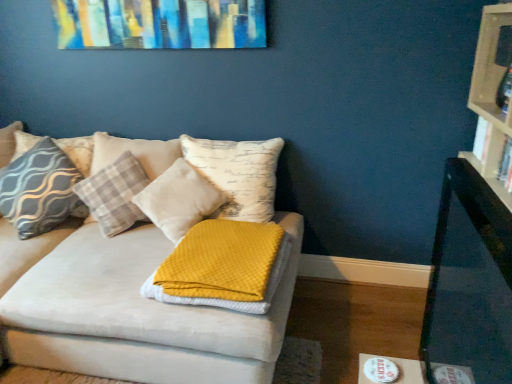
You are a GUI agent. You are given a task and a screenshot of the screen. Output one action in this format:
    pyautogui.click(x=<x>, y=<y>)
    Task: Click on the black glossy table at right
    
    Given the screenshot: What is the action you would take?
    pyautogui.click(x=470, y=280)

Image resolution: width=512 pixels, height=384 pixels. Identify the location of plaid fabric pillow at left, which ranks as the third pillow in right-to-left order. (78, 152).

Identify the location of white paper book at right, positioned as the 1th book in back-to-front order. (493, 152).

At what (x,y) coordinates should I click in order to perform the action: click on material behind the black glossy table at right. Please return your answer as a coordinate pair (x, y). This screenshot has width=512, height=384. Looking at the image, I should click on (228, 300).

Which object is positioned more to the left, black glossy table at right or waffle-textured yellow blanket at center?

From the viewer's perspective, waffle-textured yellow blanket at center appears more on the left side.

Is black glossy table at right turned away from waffle-textured yellow blanket at center?

That's not correct — black glossy table at right is not looking away from waffle-textured yellow blanket at center.

Is black glossy table at right smaller than waffle-textured yellow blanket at center?

No, black glossy table at right is not smaller than waffle-textured yellow blanket at center.

From the image's perspective, relative to hardcover book at right, acting as the second book starting from the back, is plaid fabric pillow at left, which ranks as the third pillow in right-to-left order, above or below?

plaid fabric pillow at left, which ranks as the third pillow in right-to-left order, is situated higher than hardcover book at right, acting as the second book starting from the back, in the image.

Does plaid fabric pillow at left, acting as the first pillow starting from the left, have a greater width compared to hardcover book at right, acting as the second book starting from the back?

Yes, plaid fabric pillow at left, acting as the first pillow starting from the left, is wider than hardcover book at right, acting as the second book starting from the back.

Looking at this image, is plaid fabric pillow at left, which ranks as the third pillow in right-to-left order, facing towards hardcover book at right, acting as the second book starting from the back?

No, plaid fabric pillow at left, which ranks as the third pillow in right-to-left order, is not aimed at hardcover book at right, acting as the second book starting from the back.

Relative to hardcover book at right, acting as the second book starting from the back, is plaid fabric pillow at left, which ranks as the third pillow in right-to-left order, in front or behind?

Clearly, plaid fabric pillow at left, which ranks as the third pillow in right-to-left order, is behind hardcover book at right, acting as the second book starting from the back.

From a real-world perspective, is white paper book at right, positioned as the 1th book in back-to-front order, physically located above or below gray wavy-patterned pillow at left, the second pillow positioned from the left?

white paper book at right, positioned as the 1th book in back-to-front order, is above gray wavy-patterned pillow at left, the second pillow positioned from the left.

Is white paper book at right, positioned as the 2th book in front-to-back order, behind gray wavy-patterned pillow at left, the second pillow positioned from the left?

That is False.

Is white paper book at right, positioned as the 1th book in back-to-front order, at the right side of gray wavy-patterned pillow at left, which ranks as the 2th pillow in right-to-left order?

Correct, you'll find white paper book at right, positioned as the 1th book in back-to-front order, to the right of gray wavy-patterned pillow at left, which ranks as the 2th pillow in right-to-left order.

Can you tell me how much white paper book at right, positioned as the 2th book in front-to-back order, and plaid fabric pillow at left, acting as the first pillow starting from the left, differ in facing direction?

The facing directions of white paper book at right, positioned as the 2th book in front-to-back order, and plaid fabric pillow at left, acting as the first pillow starting from the left, are 89.4 degrees apart.

Is white paper book at right, positioned as the 1th book in back-to-front order, taller or shorter than plaid fabric pillow at left, acting as the first pillow starting from the left?

Clearly, white paper book at right, positioned as the 1th book in back-to-front order, is shorter compared to plaid fabric pillow at left, acting as the first pillow starting from the left.

Is white paper book at right, positioned as the 1th book in back-to-front order, touching plaid fabric pillow at left, which ranks as the third pillow in right-to-left order?

They are not placed beside each other.

Is white paper book at right, positioned as the 1th book in back-to-front order, bigger or smaller than plaid fabric pillow at left, which ranks as the third pillow in right-to-left order?

white paper book at right, positioned as the 1th book in back-to-front order, is smaller than plaid fabric pillow at left, which ranks as the third pillow in right-to-left order.

From a real-world perspective, count 3rd pillows downward from the hardcover book at right, acting as the second book starting from the back, and point to it. Please provide its 2D coordinates.

[(178, 200)]

Considering the relative positions of hardcover book at right, which is the 1th book from front to back, and soft white pillow at center, the 3th pillow in the left-to-right sequence, in the image provided, is hardcover book at right, which is the 1th book from front to back, behind soft white pillow at center, the 3th pillow in the left-to-right sequence,?

No, hardcover book at right, which is the 1th book from front to back, is closer to the camera.

Looking at this image, based on their sizes in the image, would you say hardcover book at right, which is the 1th book from front to back, is bigger or smaller than soft white pillow at center, which appears as the 1th pillow when viewed from the right?

Considering their sizes, hardcover book at right, which is the 1th book from front to back, takes up less space than soft white pillow at center, which appears as the 1th pillow when viewed from the right.

Relative to waffle-textured yellow blanket at center, is plaid fabric pillow at left, which ranks as the third pillow in right-to-left order, in front or behind?

plaid fabric pillow at left, which ranks as the third pillow in right-to-left order, is behind waffle-textured yellow blanket at center.

Is plaid fabric pillow at left, acting as the first pillow starting from the left, taller or shorter than waffle-textured yellow blanket at center?

In the image, plaid fabric pillow at left, acting as the first pillow starting from the left, appears to be taller than waffle-textured yellow blanket at center.

Considering the relative positions of plaid fabric pillow at left, which ranks as the third pillow in right-to-left order, and waffle-textured yellow blanket at center in the image provided, is plaid fabric pillow at left, which ranks as the third pillow in right-to-left order, to the right of waffle-textured yellow blanket at center from the viewer's perspective?

Incorrect, plaid fabric pillow at left, which ranks as the third pillow in right-to-left order, is not on the right side of waffle-textured yellow blanket at center.

At what (x,y) coordinates should I click in order to perform the action: click on material below the plaid fabric pillow at left, acting as the first pillow starting from the left (from the image's perspective). Please return your answer as a coordinate pair (x, y). This screenshot has height=384, width=512. Looking at the image, I should click on (228, 300).

Is soft white pillow at center, which appears as the 1th pillow when viewed from the right, in front of or behind white paper book at right, positioned as the 1th book in back-to-front order, in the image?

Clearly, soft white pillow at center, which appears as the 1th pillow when viewed from the right, is behind white paper book at right, positioned as the 1th book in back-to-front order.

From the image's perspective, which is above, soft white pillow at center, the 3th pillow in the left-to-right sequence, or white paper book at right, positioned as the 1th book in back-to-front order?

white paper book at right, positioned as the 1th book in back-to-front order, from the image's perspective.

Starting from the soft white pillow at center, the 3th pillow in the left-to-right sequence, which book is the 1st one in front? Please provide its 2D coordinates.

[(493, 152)]

In the scene shown: Can you tell me how much soft white pillow at center, the 3th pillow in the left-to-right sequence, and white paper book at right, positioned as the 2th book in front-to-back order, differ in facing direction?

They differ by 77.3 degrees in their facing directions.

Image resolution: width=512 pixels, height=384 pixels. What are the coordinates of `material behind the black glossy table at right` in the screenshot? It's located at (228, 300).

Find the location of a particular element. pillow that is above the hardcover book at right, acting as the second book starting from the back (from the image's perspective) is located at coordinates (78, 152).

Looking at the image, which one is located further to soft white pillow at center, the 3th pillow in the left-to-right sequence, gray wavy-patterned pillow at left, the second pillow positioned from the left, or plaid fabric pillow at left, which ranks as the third pillow in right-to-left order?

plaid fabric pillow at left, which ranks as the third pillow in right-to-left order, is positioned further to the anchor soft white pillow at center, the 3th pillow in the left-to-right sequence.

Based on their spatial positions, is soft white pillow at center, the 3th pillow in the left-to-right sequence, or black glossy table at right further from waffle-textured yellow blanket at center?

black glossy table at right lies further to waffle-textured yellow blanket at center than the other object.

Which object lies nearer to the anchor point gray wavy-patterned pillow at left, the second pillow positioned from the left, soft white pillow at center, the 3th pillow in the left-to-right sequence, or plaid fabric pillow at left, which ranks as the third pillow in right-to-left order?

plaid fabric pillow at left, which ranks as the third pillow in right-to-left order, is closer to gray wavy-patterned pillow at left, the second pillow positioned from the left.

Based on their spatial positions, is gray wavy-patterned pillow at left, which ranks as the 2th pillow in right-to-left order, or black glossy table at right further from white paper book at right, positioned as the 1th book in back-to-front order?

gray wavy-patterned pillow at left, which ranks as the 2th pillow in right-to-left order, lies further to white paper book at right, positioned as the 1th book in back-to-front order, than the other object.

Considering their positions, is gray wavy-patterned pillow at left, which ranks as the 2th pillow in right-to-left order, positioned further to waffle-textured yellow blanket at center than hardcover book at right, which is the 1th book from front to back?

Based on the image, hardcover book at right, which is the 1th book from front to back, appears to be further to waffle-textured yellow blanket at center.

Estimate the real-world distances between objects in this image. Which object is closer to waffle-textured yellow blanket at center, gray wavy-patterned pillow at left, which ranks as the 2th pillow in right-to-left order, or soft white pillow at center, the 3th pillow in the left-to-right sequence?

soft white pillow at center, the 3th pillow in the left-to-right sequence.

Based on the photo, when comparing their distances from plaid fabric pillow at left, acting as the first pillow starting from the left, does black glossy table at right or soft white pillow at center, which appears as the 1th pillow when viewed from the right, seem further?

black glossy table at right.

Which object lies nearer to the anchor point black glossy table at right, hardcover book at right, which is the 1th book from front to back, or gray wavy-patterned pillow at left, the second pillow positioned from the left?

Based on the image, hardcover book at right, which is the 1th book from front to back, appears to be nearer to black glossy table at right.

Locate an element on the screen. This screenshot has height=384, width=512. material located between soft white pillow at center, which appears as the 1th pillow when viewed from the right, and white paper book at right, positioned as the 2th book in front-to-back order, in the left-right direction is located at coordinates point(228,300).

Identify the location of material situated between gray wavy-patterned pillow at left, the second pillow positioned from the left, and white paper book at right, positioned as the 1th book in back-to-front order, from left to right. The image size is (512, 384). (228, 300).

Identify the location of book situated between gray wavy-patterned pillow at left, which ranks as the 2th pillow in right-to-left order, and white paper book at right, positioned as the 1th book in back-to-front order, from left to right. (506, 165).

Where is `book situated between plaid fabric pillow at left, which ranks as the third pillow in right-to-left order, and white paper book at right, positioned as the 1th book in back-to-front order, from left to right`? book situated between plaid fabric pillow at left, which ranks as the third pillow in right-to-left order, and white paper book at right, positioned as the 1th book in back-to-front order, from left to right is located at coordinates (506, 165).